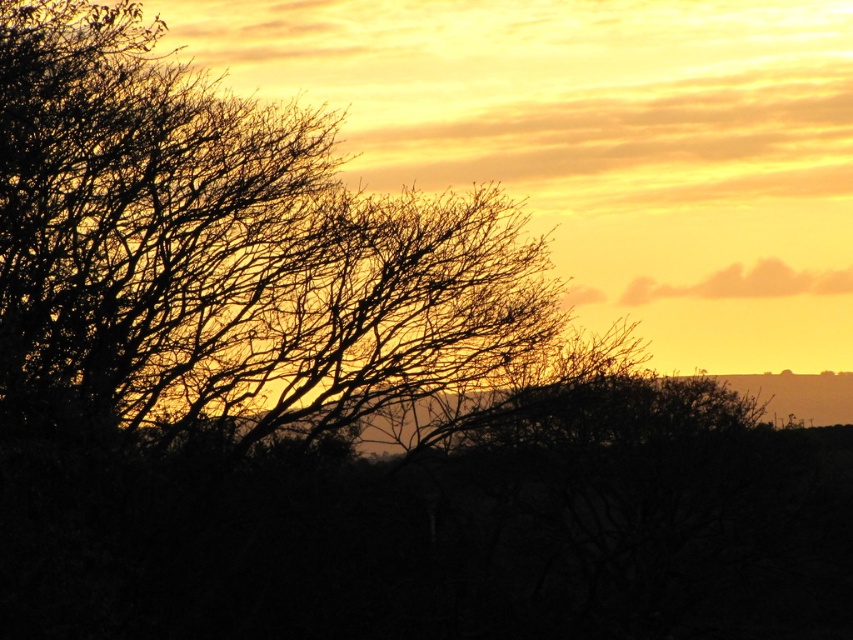
You are an artist sketching the sunset scene. You want to draw the silhouette branches at left and the cloudy orange sky at upper right. Which object should you draw first to maintain the correct spatial relationship?

You should draw the cloudy orange sky at upper right first because the silhouette branches at left is below it, so the sky needs to be placed above the branches to maintain the correct spatial relationship.

You are a bird flying at an altitude of 150 feet. You see the silhouette branches at left in the sunset scene. Can you safely land on them?

The silhouette branches at left are 150.10 feet apart. Since you are flying at 150 feet, you are just below the branches. However, the distance between the branches is over 150 feet, so you might not find a suitable spot to land safely on them.

In the sunset scene, you notice the silhouette branches at left and the cloudy orange sky at upper right. Which of these two elements takes up more space in the image?

The silhouette branches at left is larger in size than the cloudy orange sky at upper right, so it takes up more space in the image.